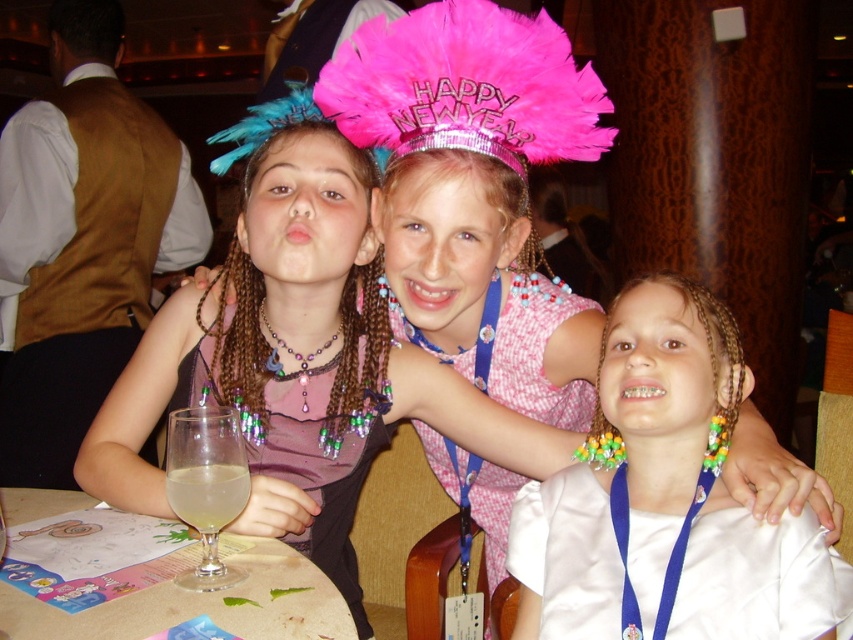
Can you confirm if clear glass wine glass at lower left is shorter than translucent glass at table left?

In fact, clear glass wine glass at lower left may be taller than translucent glass at table left.

Based on the photo, can you confirm if clear glass wine glass at lower left is positioned above translucent glass at table left?

No, clear glass wine glass at lower left is not above translucent glass at table left.

Find the location of a particular element. This screenshot has height=640, width=853. clear glass wine glass at lower left is located at coordinates (206, 484).

From the picture: Can you confirm if wooden table at center is positioned to the left of purple satin dress at center?

Indeed, wooden table at center is positioned on the left side of purple satin dress at center.

Is wooden table at center closer to the viewer compared to purple satin dress at center?

Yes.

Who is more distant from viewer, (297, 614) or (351, 472)?

Point (351, 472)

The height and width of the screenshot is (640, 853). Identify the location of wooden table at center. pos(199,605).

Who is lower down, purple satin dress at center or translucent glass at table left?

Positioned lower is purple satin dress at center.

From the picture: Does purple satin dress at center have a greater height compared to translucent glass at table left?

Indeed, purple satin dress at center has a greater height compared to translucent glass at table left.

Image resolution: width=853 pixels, height=640 pixels. What are the coordinates of `purple satin dress at center` in the screenshot? It's located at (318, 474).